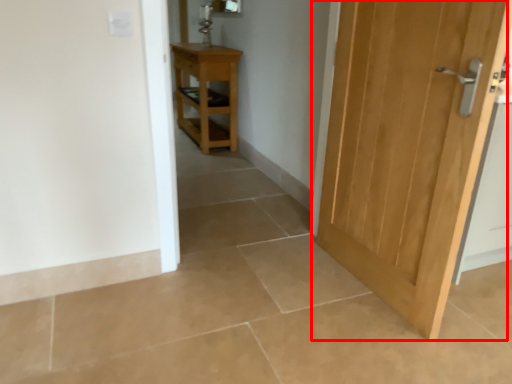
Question: Observing the image, what is the correct spatial positioning of door (annotated by the red box) in reference to nightstand?

Choices:
 (A) right
 (B) left

Answer: (A)